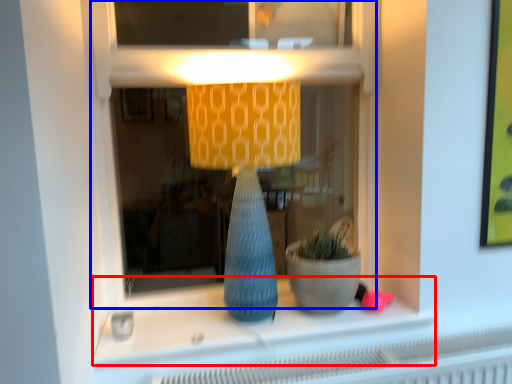
Question: Which object appears closest to the camera in this image, window sill (highlighted by a red box) or shop window (highlighted by a blue box)?

Choices:
 (A) window sill
 (B) shop window

Answer: (B)